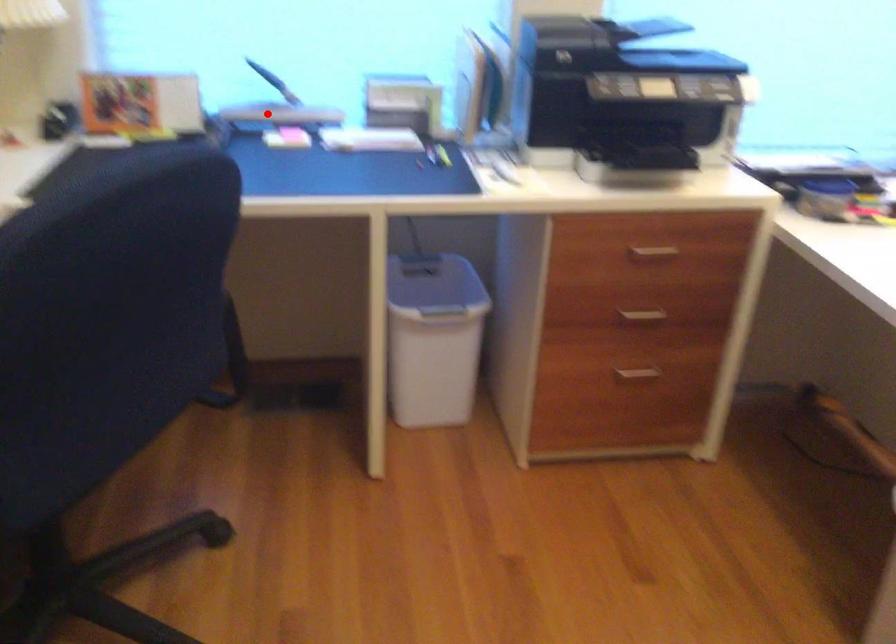
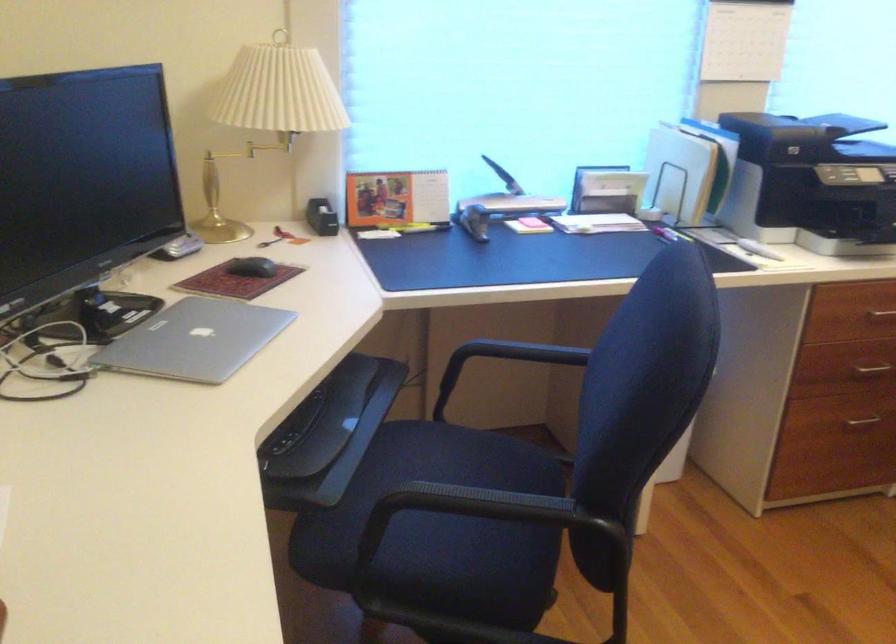
In the second image, find the point that corresponds to the highlighted location in the first image.

(502, 205)